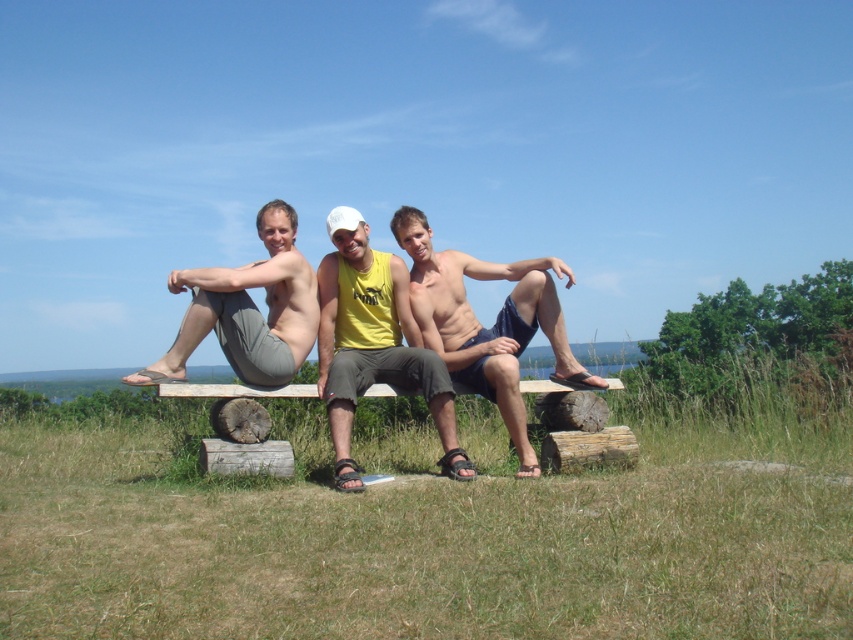
You are a fashion designer observing the three people on the rustic wooden bench. You need to determine which clothing item, the yellow matte tank top at center or the matte gray pants at center, has a narrower width. Which one is it?

The yellow matte tank top at center is thinner than the matte gray pants at center, so the yellow matte tank top at center has a narrower width.

Looking at the two people sitting on the rustic wooden bench, which one is wearing the matte blue shorts at center and where are they positioned relative to the person in matte gray pants at center?

The matte blue shorts at center are worn by the person to the right of the matte gray pants at center.

You are a fashion designer observing the three people on the rustic wooden bench. You need to determine which clothing item is taller between the yellow matte tank top at center and the matte gray pants at center. Based on the scene description, which one is taller?

The yellow matte tank top at center is taller than the matte gray pants at center according to the description.